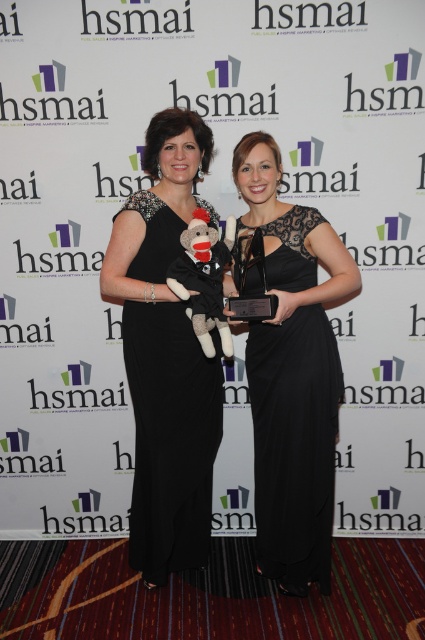
You are a photographer setting up for a group photo. You notice two dresses in the scene. The black lace dress at center and the black satin dress at left. Which dress is closer to the camera?

The black lace dress at center is closer to the camera because it is in front of the black satin dress at left.

You are standing at the camera position and want to place a 1.5 meter long banner between you and the point at coordinates point (299, 324). Will the banner fit without overlapping the point?

The distance between the camera and the point (299, 324) is 2.00 meters. Since the banner is 1.5 meters long, it will fit without overlapping the point as there is enough space between the camera and the point.

You are a photographer setting up for a group photo. You have two women wearing the black lace dress at center and the black satin dress at left. The distance between them is 11.89 inches. If you want to ensure they are spaced at least 12 inches apart for better visibility, do you need to adjust their positions?

The distance between the black lace dress at center and the black satin dress at left is 11.89 inches, which is slightly less than the required 12 inches. Therefore, you should adjust their positions to increase the distance to meet the spacing requirement.